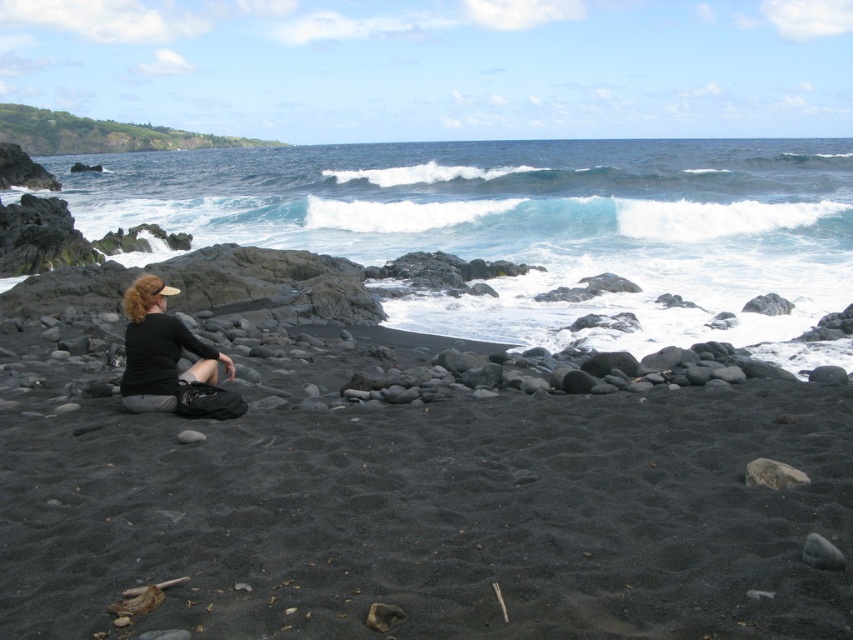
Question: Is the position of matte black shirt at center less distant than that of gray smooth rock at lower right?

Choices:
 (A) yes
 (B) no

Answer: (B)

Question: Among these objects, which one is farthest from the camera?

Choices:
 (A) gray smooth rock at lower right
 (B) matte black shirt at center
 (C) smooth gray rock at center

Answer: (B)

Question: Considering the real-world distances, which object is farthest from the smooth gray rock at center?

Choices:
 (A) gray smooth rock at lower right
 (B) matte black shirt at center

Answer: (B)

Question: Observing the image, what is the correct spatial positioning of matte black shirt at center in reference to gray smooth rock at lower right?

Choices:
 (A) left
 (B) right

Answer: (A)

Question: Estimate the real-world distances between objects in this image. Which object is farther from the matte black shirt at center?

Choices:
 (A) gray smooth rock at lower right
 (B) smooth gray rock at center

Answer: (B)

Question: From the image, what is the correct spatial relationship of matte black shirt at center in relation to smooth gray rock at center?

Choices:
 (A) left
 (B) right

Answer: (A)